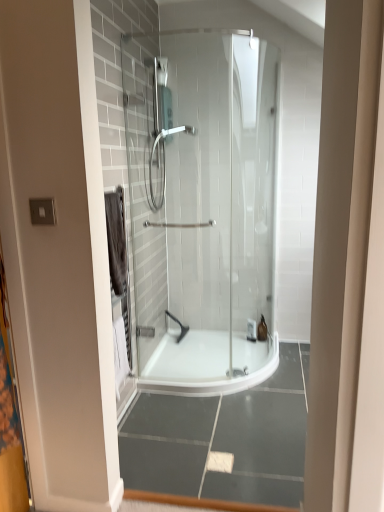
Question: Is translucent glass toiletry at center, which ranks as the second toiletry in left-to-right order, inside the boundaries of black rubber showerhead at center, which ranks as the 2th shower in front-to-back order, or outside?

Choices:
 (A) outside
 (B) inside

Answer: (A)

Question: From the image's perspective, is translucent glass toiletry at center, which ranks as the second toiletry in left-to-right order, above or below black rubber showerhead at center, marked as the second shower in a top-to-bottom arrangement?

Choices:
 (A) above
 (B) below

Answer: (B)

Question: Considering the real-world distances, which object is farthest from the white plastic bottle at center, which is the first toiletry from left to right?

Choices:
 (A) translucent glass toiletry at center, which ranks as the second toiletry in left-to-right order
 (B) black rubber showerhead at center, marked as the second shower in a top-to-bottom arrangement
 (C) matte silver shower head at center, arranged as the second shower when ordered from the bottom

Answer: (C)

Question: Considering the real-world distances, which object is farthest from the translucent glass toiletry at center, which ranks as the second toiletry in left-to-right order?

Choices:
 (A) black rubber showerhead at center, marked as the second shower in a top-to-bottom arrangement
 (B) matte silver shower head at center, arranged as the second shower when ordered from the bottom
 (C) white plastic bottle at center, arranged as the 2th toiletry when viewed from the right

Answer: (B)